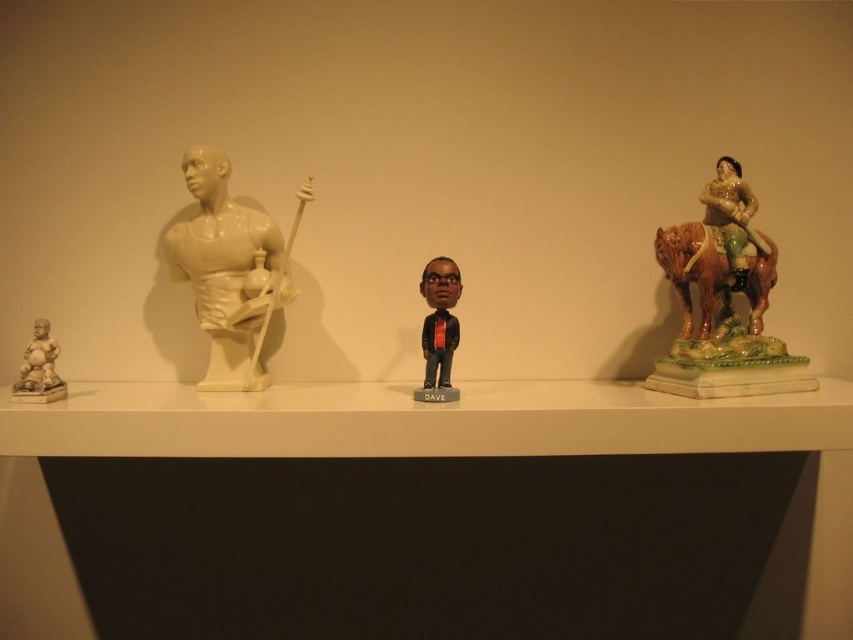
Question: In this image, where is white glossy shelf at center located relative to multicolored ceramic horse rider at right?

Choices:
 (A) above
 (B) below

Answer: (B)

Question: Which point is farther to the camera?

Choices:
 (A) coord(453,340)
 (B) coord(33,324)

Answer: (A)

Question: Which of these objects is positioned farthest from the matte black bobblehead at center?

Choices:
 (A) white glossy shelf at center
 (B) multicolored ceramic horse rider at right

Answer: (B)

Question: Is multicolored ceramic horse rider at right further to the viewer compared to matte black bobblehead at center?

Choices:
 (A) no
 (B) yes

Answer: (B)

Question: Among these points, which one is nearest to the camera?

Choices:
 (A) (556, 454)
 (B) (444, 294)
 (C) (32, 364)

Answer: (A)

Question: Does white glossy shelf at center appear over matte beige statue at left?

Choices:
 (A) yes
 (B) no

Answer: (B)